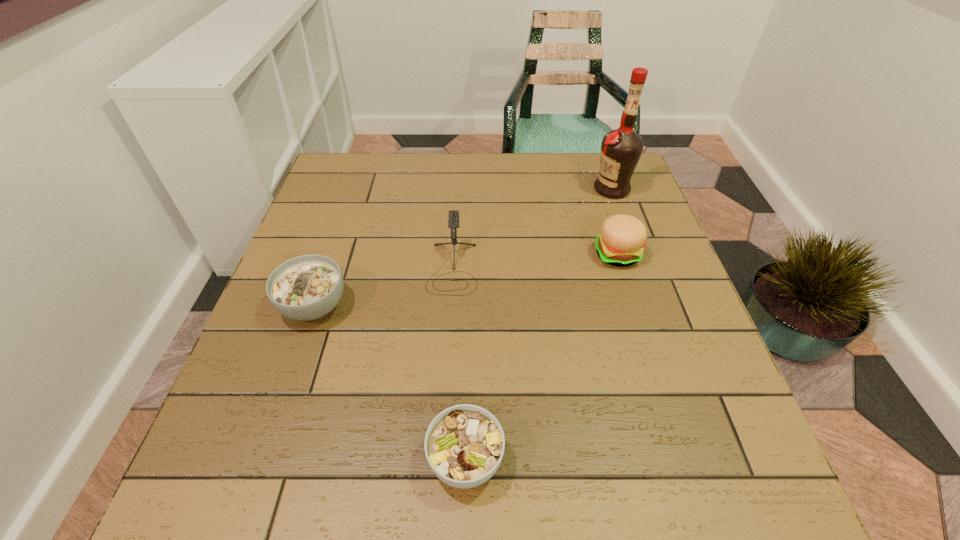
At what (x,y) coordinates should I click in order to perform the action: click on vacant space situated 0.380m on the front and back of the farthest object. Please return your answer as a coordinate pair (x, y). The height and width of the screenshot is (540, 960). Looking at the image, I should click on (459, 189).

Image resolution: width=960 pixels, height=540 pixels. Identify the location of vacant space located 0.370m on the stand of the microphone. (441, 467).

You are a GUI agent. You are given a task and a screenshot of the screen. Output one action in this format:
    pyautogui.click(x=<x>, y=<y>)
    Task: Click on the vacant region located 0.050m on the front of the hamburger
    
    Given the screenshot: What is the action you would take?
    pyautogui.click(x=627, y=286)

Identify the location of free region located 0.050m on the right of the leftmost object. (372, 306).

Identify the location of free space located on the right of the shorter soup bowl. The width and height of the screenshot is (960, 540). (650, 460).

In order to click on object located in the far edge section of the desktop in this screenshot , I will do `click(621, 149)`.

At what (x,y) coordinates should I click in order to perform the action: click on object that is positioned at the near edge. Please return your answer as a coordinate pair (x, y). Looking at the image, I should click on (464, 445).

Image resolution: width=960 pixels, height=540 pixels. I want to click on object at the left edge, so click(307, 287).

The width and height of the screenshot is (960, 540). Find the location of `liquor situated at the right edge`. liquor situated at the right edge is located at coordinates 621,149.

Identify the location of hamburger that is at the right edge. (620, 243).